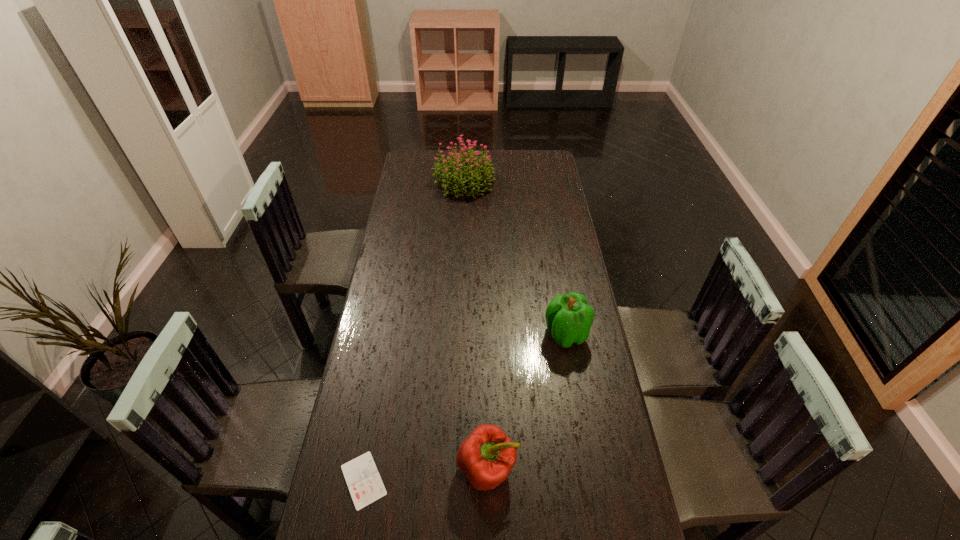
Image resolution: width=960 pixels, height=540 pixels. I want to click on object that is the closest one to the taller bell pepper, so click(x=486, y=457).

Point out which object is positioned as the nearest to the taller bell pepper. Please provide its 2D coordinates. Your answer should be formatted as a tuple, i.e. [(x, y)], where the tuple contains the x and y coordinates of a point satisfying the conditions above.

[(486, 457)]

Find the location of a particular element. vacant space that satisfies the following two spatial constraints: 1. on the back side of the nearer bell pepper; 2. on the right side of the leftmost object is located at coordinates (366, 469).

The image size is (960, 540). What are the coordinates of `free space that satisfies the following two spatial constraints: 1. on the back side of the nearer bell pepper; 2. on the right side of the leftmost object` in the screenshot? It's located at click(x=366, y=469).

Where is `vacant area in the image that satisfies the following two spatial constraints: 1. on the back side of the nearer bell pepper; 2. on the left side of the taller bell pepper`? Image resolution: width=960 pixels, height=540 pixels. vacant area in the image that satisfies the following two spatial constraints: 1. on the back side of the nearer bell pepper; 2. on the left side of the taller bell pepper is located at coordinates (486, 334).

I want to click on free location that satisfies the following two spatial constraints: 1. on the front side of the second farthest object; 2. on the right side of the farthest object, so click(x=458, y=334).

You are a GUI agent. You are given a task and a screenshot of the screen. Output one action in this format:
    pyautogui.click(x=<x>, y=<y>)
    Task: Click on the vacant space that satisfies the following two spatial constraints: 1. on the front side of the farthest object; 2. on the left side of the third nearest object
    
    Given the screenshot: What is the action you would take?
    pyautogui.click(x=458, y=334)